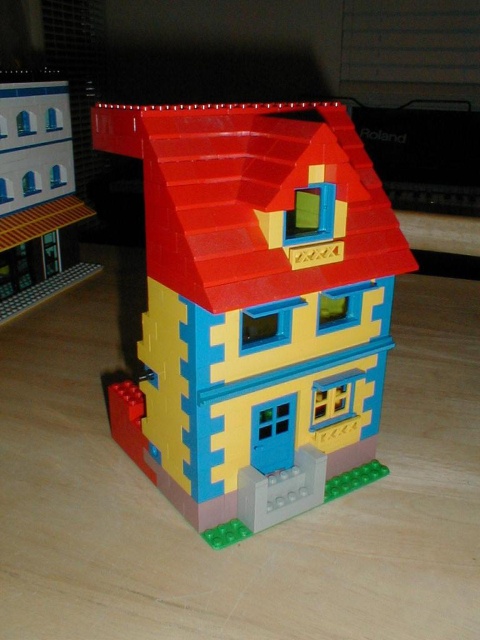
Does point (278, 328) lie behind point (41, 113)?

No, (278, 328) is in front of (41, 113).

Is brick-like plastic house at center closer to camera compared to smooth white building at upper left?

Yes, it is in front of smooth white building at upper left.

Image resolution: width=480 pixels, height=640 pixels. What do you see at coordinates (255, 305) in the screenshot?
I see `brick-like plastic house at center` at bounding box center [255, 305].

Locate an element on the screen. brick-like plastic house at center is located at coordinates (255, 305).